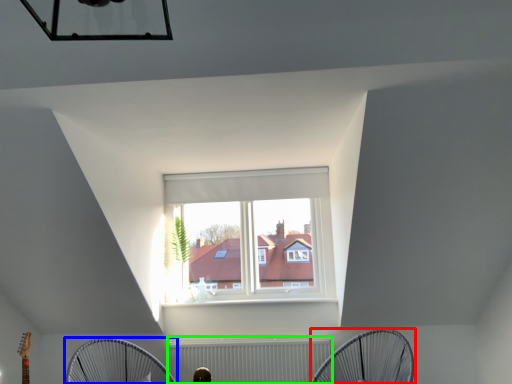
Question: Which object is the farthest from mechanical fan (highlighted by a red box)? Choose among these: mechanical fan (highlighted by a blue box) or radiator (highlighted by a green box).

Choices:
 (A) mechanical fan
 (B) radiator

Answer: (A)